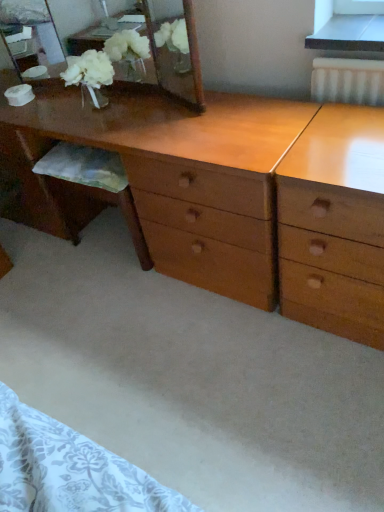
Describe the element at coordinates (161, 53) in the screenshot. I see `wooden mirror at upper left` at that location.

The image size is (384, 512). I want to click on wooden mirror at upper left, so click(x=161, y=53).

What do you see at coordinates (243, 195) in the screenshot? I see `light brown wood desk at center` at bounding box center [243, 195].

Find the location of a particular element. This screenshot has height=512, width=384. light brown wood desk at center is located at coordinates (243, 195).

The height and width of the screenshot is (512, 384). I want to click on wooden mirror at upper left, so tap(161, 53).

Consider the image. Which is more to the left, wooden mirror at upper left or light brown wood desk at center?

wooden mirror at upper left is more to the left.

Is wooden mirror at upper left further to the viewer compared to light brown wood desk at center?

Yes, wooden mirror at upper left is further from the camera.

Between point (135, 81) and point (253, 217), which one is positioned in front?

The point (253, 217) is closer to the camera.

From the image's perspective, which one is positioned higher, wooden mirror at upper left or light brown wood desk at center?

wooden mirror at upper left appears higher in the image.

From a real-world perspective, who is located higher, wooden mirror at upper left or light brown wood desk at center?

wooden mirror at upper left is physically above.

Is wooden mirror at upper left wider than light brown wood desk at center?

In fact, wooden mirror at upper left might be narrower than light brown wood desk at center.

Can you confirm if wooden mirror at upper left is taller than light brown wood desk at center?

No.

Considering the sizes of objects wooden mirror at upper left and light brown wood desk at center in the image provided, who is bigger, wooden mirror at upper left or light brown wood desk at center?

light brown wood desk at center.

Is wooden mirror at upper left positioned beyond the bounds of light brown wood desk at center?

wooden mirror at upper left is positioned outside light brown wood desk at center.

Can you see wooden mirror at upper left touching light brown wood desk at center?

Answer: They are not placed beside each other.

Is wooden mirror at upper left facing away from light brown wood desk at center?

That's not correct — wooden mirror at upper left is not looking away from light brown wood desk at center.

How different are the orientations of wooden mirror at upper left and light brown wood desk at center in degrees?

They differ by 0.323 degrees in their facing directions.

What are the coordinates of `desk below the wooden mirror at upper left (from a real-world perspective)` in the screenshot? It's located at (243, 195).

Considering the positions of objects light brown wood desk at center and wooden mirror at upper left in the image provided, who is more to the left, light brown wood desk at center or wooden mirror at upper left?

wooden mirror at upper left is more to the left.

Is light brown wood desk at center closer to camera compared to wooden mirror at upper left?

Yes, light brown wood desk at center is closer to the camera.

Considering the points (203, 236) and (14, 20), which point is in front, point (203, 236) or point (14, 20)?

Point (203, 236)

From the image's perspective, which one is positioned lower, light brown wood desk at center or wooden mirror at upper left?

light brown wood desk at center is shown below in the image.

From a real-world perspective, between light brown wood desk at center and wooden mirror at upper left, who is vertically lower?

In real-world perspective, light brown wood desk at center is lower.

In the scene shown: Between light brown wood desk at center and wooden mirror at upper left, which one has larger width?

light brown wood desk at center is wider.

Considering the relative sizes of light brown wood desk at center and wooden mirror at upper left in the image provided, is light brown wood desk at center taller than wooden mirror at upper left?

Indeed, light brown wood desk at center has a greater height compared to wooden mirror at upper left.

Considering the relative sizes of light brown wood desk at center and wooden mirror at upper left in the image provided, is light brown wood desk at center smaller than wooden mirror at upper left?

Incorrect, light brown wood desk at center is not smaller in size than wooden mirror at upper left.

Is light brown wood desk at center located outside wooden mirror at upper left?

Yes.

Is light brown wood desk at center touching wooden mirror at upper left?

There is a gap between light brown wood desk at center and wooden mirror at upper left.

Is light brown wood desk at center turned away from wooden mirror at upper left?

light brown wood desk at center does not have its back to wooden mirror at upper left.

Measure the distance between light brown wood desk at center and wooden mirror at upper left.

light brown wood desk at center is 1.02 meters from wooden mirror at upper left.

Locate an element on the screen. mirror above the light brown wood desk at center (from the image's perspective) is located at coordinates (161, 53).

Locate an element on the screen. The width and height of the screenshot is (384, 512). mirror that appears above the light brown wood desk at center (from a real-world perspective) is located at coordinates (161, 53).

Identify the location of desk below the wooden mirror at upper left (from the image's perspective). (243, 195).